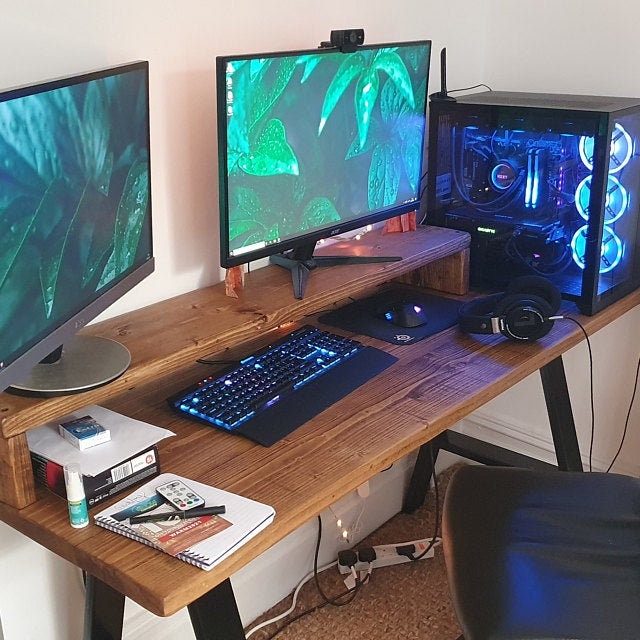
The image size is (640, 640). Identify the location of wall. (172, 26).